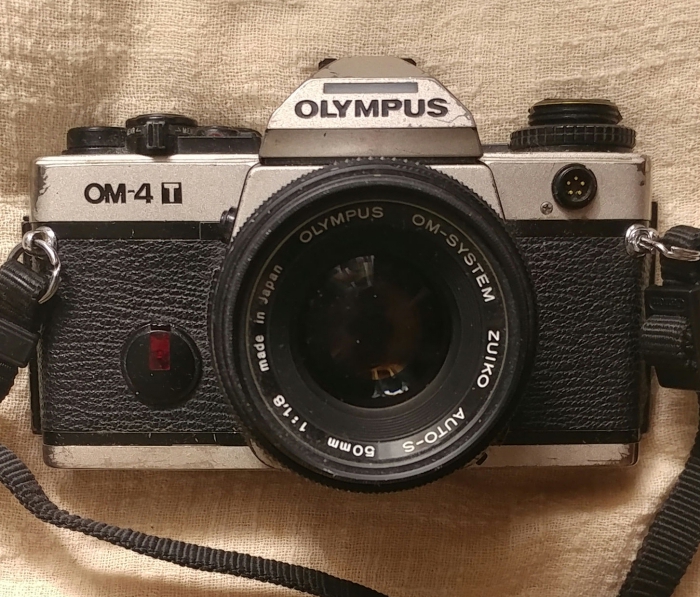
Locate an element on the screen. This screenshot has height=597, width=700. textured fabric is located at coordinates (173, 50).